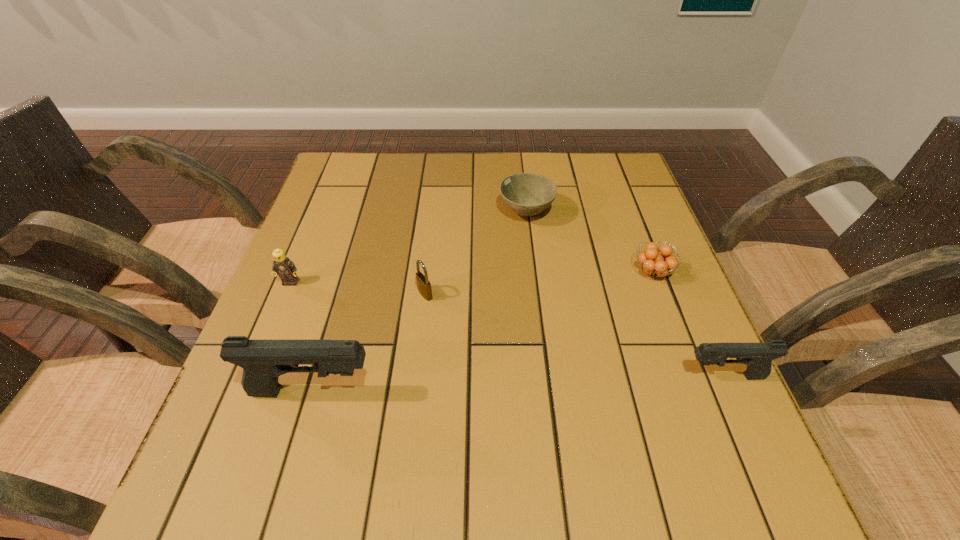
The image size is (960, 540). Find the location of `the tallest object`. the tallest object is located at coordinates (263, 361).

Where is `the taller pistol`? This screenshot has height=540, width=960. the taller pistol is located at coordinates (263, 361).

Where is `the farther pistol`? the farther pistol is located at coordinates (758, 357).

In order to click on the right pistol in this screenshot , I will do point(758,357).

Find the location of a particular element. This screenshot has width=960, height=540. orange fruit is located at coordinates (656, 263).

What are the coordinates of `Lego` in the screenshot? It's located at (283, 266).

The height and width of the screenshot is (540, 960). Find the location of `padlock`. padlock is located at coordinates 424,286.

Identify the location of bowl. This screenshot has width=960, height=540. (527, 194).

Find the location of a particular element. the farthest object is located at coordinates (527, 194).

The image size is (960, 540). I want to click on free location located 0.200m at the barrel of the nearer pistol, so click(x=485, y=392).